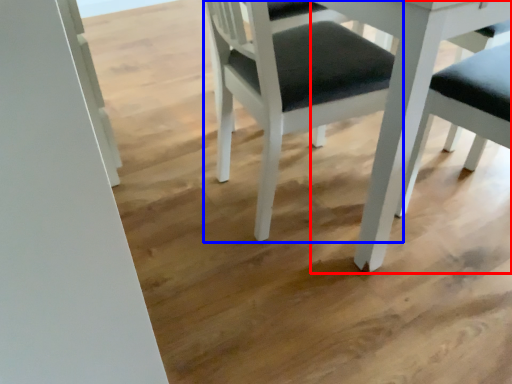
Question: Which point is closer to the camera, table (highlighted by a red box) or chair (highlighted by a blue box)?

Choices:
 (A) table
 (B) chair

Answer: (A)